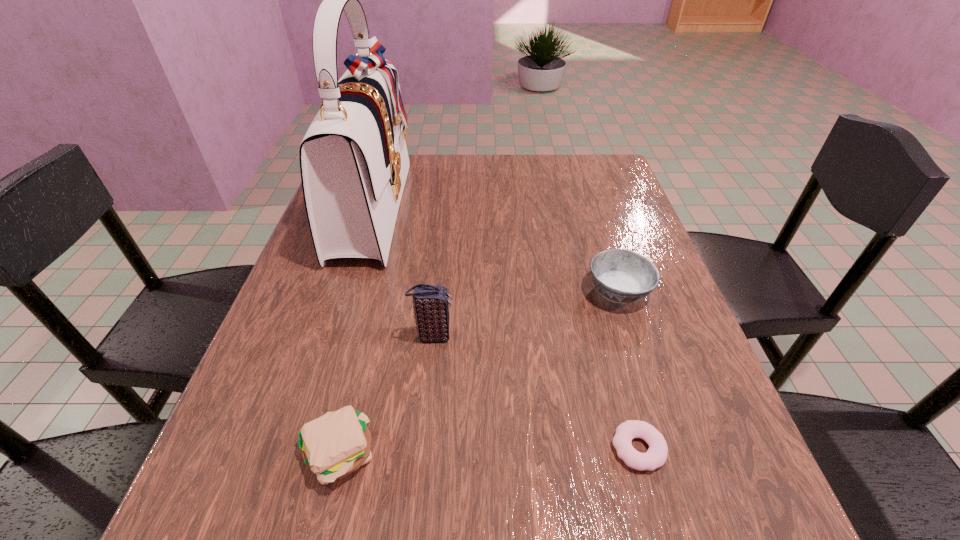
Find the location of a particular element. Image resolution: width=960 pixels, height=540 pixels. free space that satisfies the following two spatial constraints: 1. on the back side of the shortest object; 2. on the left side of the patty is located at coordinates (339, 448).

Identify the location of vacant position in the image that satisfies the following two spatial constraints: 1. on the front-facing side of the patty; 2. on the left side of the satchel. The image size is (960, 540). (296, 454).

This screenshot has width=960, height=540. What are the coordinates of `free space that satisfies the following two spatial constraints: 1. on the front-facing side of the tallest object; 2. on the right side of the doughnut` in the screenshot? It's located at (298, 448).

This screenshot has height=540, width=960. In order to click on free space that satisfies the following two spatial constraints: 1. on the front-facing side of the satchel; 2. on the left side of the patty in this screenshot , I will do `click(296, 454)`.

Locate an element on the screen. The image size is (960, 540). free space in the image that satisfies the following two spatial constraints: 1. on the front-facing side of the ashtray; 2. on the right side of the tallest object is located at coordinates coord(347,292).